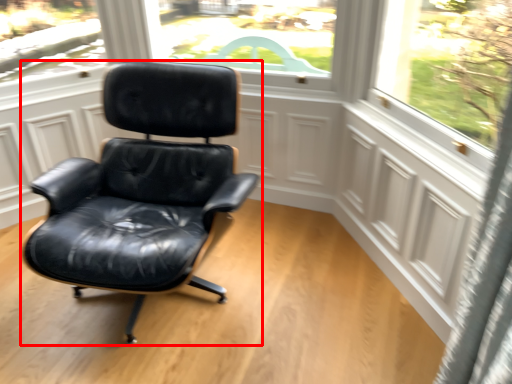
Question: From the image's perspective, what is the correct spatial relationship of chair (annotated by the red box) in relation to screen door?

Choices:
 (A) above
 (B) below

Answer: (A)